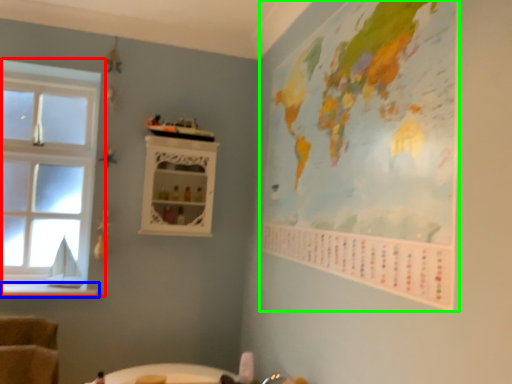
Question: Based on their relative distances, which object is farther from window (highlighted by a red box)? Choose from window sill (highlighted by a blue box) and map (highlighted by a green box).

Choices:
 (A) window sill
 (B) map

Answer: (B)